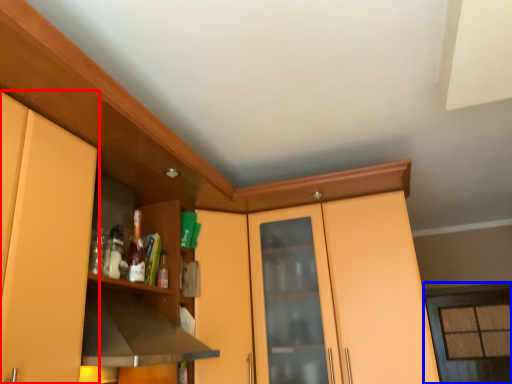
Question: Which object is further to the camera taking this photo, cabinetry (highlighted by a red box) or window (highlighted by a blue box)?

Choices:
 (A) cabinetry
 (B) window

Answer: (B)